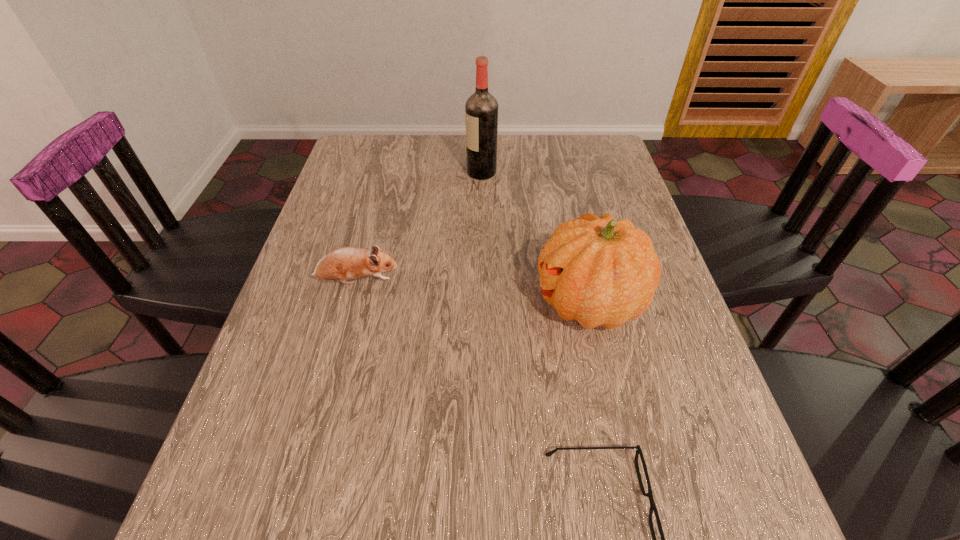
This screenshot has height=540, width=960. In order to click on free location at the far right corner of the desktop in this screenshot , I will do `click(621, 164)`.

I want to click on vacant space that's between the farthest object and the second tallest object, so click(x=536, y=238).

Locate an element on the screen. vacant space in between the pumpkin and the second shortest object is located at coordinates (473, 292).

The height and width of the screenshot is (540, 960). I want to click on free area in between the second shortest object and the pumpkin, so click(x=473, y=292).

Where is `vacant area that lies between the second tallest object and the hamster`? The width and height of the screenshot is (960, 540). vacant area that lies between the second tallest object and the hamster is located at coordinates (473, 292).

In order to click on empty space that is in between the hamster and the pumpkin in this screenshot , I will do `click(473, 292)`.

Find the location of a particular element. free space between the third shortest object and the second object from left to right is located at coordinates (536, 238).

You are a GUI agent. You are given a task and a screenshot of the screen. Output one action in this format:
    pyautogui.click(x=<x>, y=<y>)
    Task: Click on the object that stands as the second closest to the pumpkin
    This screenshot has width=960, height=540.
    Given the screenshot: What is the action you would take?
    pyautogui.click(x=344, y=263)

The width and height of the screenshot is (960, 540). Find the location of `object that is the closest one to the pumpkin`. object that is the closest one to the pumpkin is located at coordinates pos(638,449).